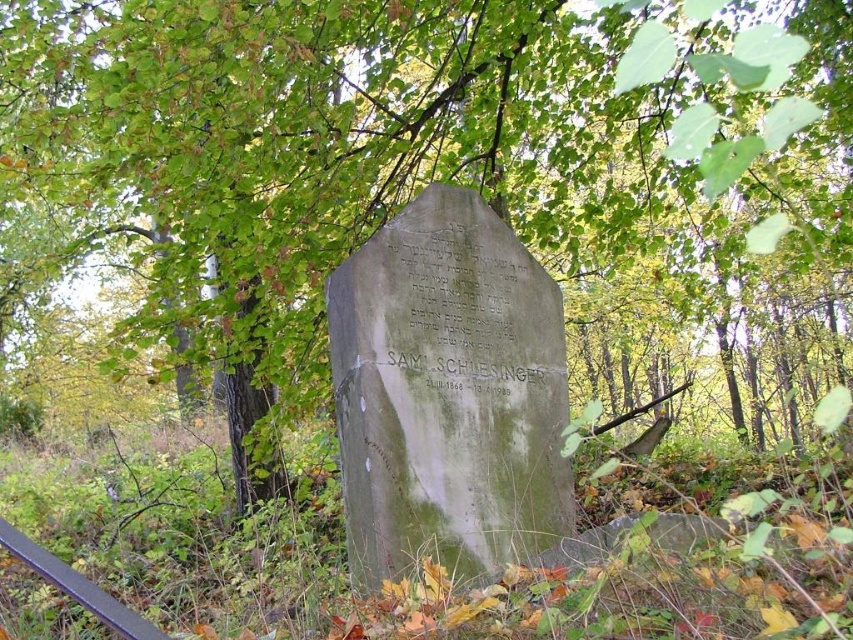
In the scene shown: You are a maintenance worker needing to reach the metallic rail at lower left from the green mossy stone at center. Given that your ladder is 8 feet long, will it be sufficient to bridge the gap between them?

The distance between the green mossy stone at center and the metallic rail at lower left is 8.60 feet. Since the ladder is only 8 feet long, it is 0.60 feet shorter than needed, so the ladder will not be sufficient to bridge the gap between them.

You are a landscape architect designing a pathway near the green mossy stone at center and the metallic rail at lower left. Since you need to know their sizes to plan the path width, which object is bigger?

The green mossy stone at center is larger in size than the metallic rail at lower left, so the path should be designed to accommodate the larger size of the green mossy stone at center.

You are a visitor at a cemetery and see the green mossy stone at center and the metallic rail at lower left. Which object is located higher up in the image?

The green mossy stone at center is positioned over the metallic rail at lower left, so it is higher up in the image.